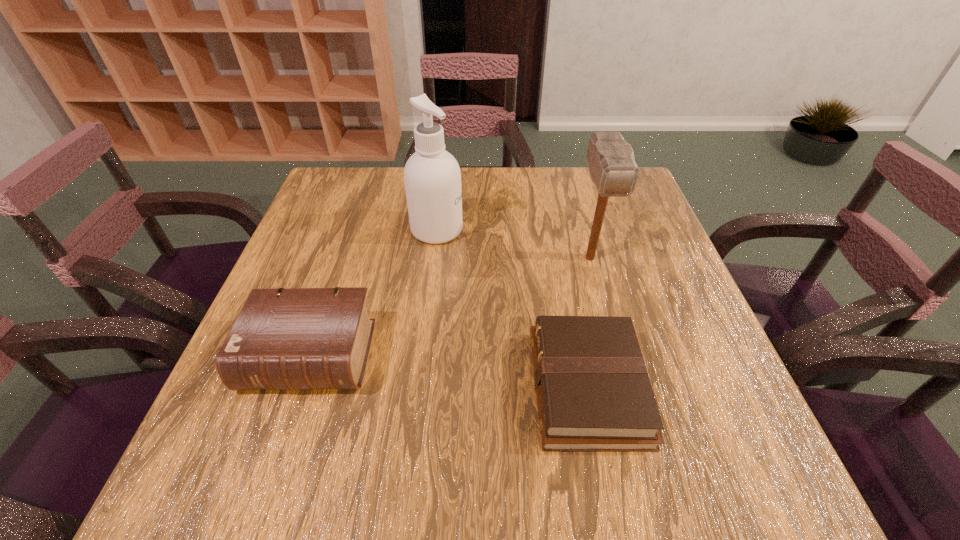
This screenshot has width=960, height=540. Identify the location of free space located 0.380m on the spine side of the right Bible. (323, 387).

I want to click on vacant area situated on the spine side of the right Bible, so click(x=339, y=387).

I want to click on object present at the far edge, so click(432, 177).

Find the location of a particular element. Image resolution: width=960 pixels, height=540 pixels. object at the near edge is located at coordinates (593, 391).

You are a GUI agent. You are given a task and a screenshot of the screen. Output one action in this format:
    pyautogui.click(x=<x>, y=<y>)
    Task: Click on the object located at the left edge
    
    Given the screenshot: What is the action you would take?
    pyautogui.click(x=289, y=338)

Where is `object that is at the right edge`? Image resolution: width=960 pixels, height=540 pixels. object that is at the right edge is located at coordinates (612, 166).

This screenshot has width=960, height=540. Find the location of `vacant area at the far edge`. vacant area at the far edge is located at coordinates (560, 174).

This screenshot has height=540, width=960. In the image, there is a desktop. What are the coordinates of `vacant space at the near edge` in the screenshot? It's located at (450, 462).

Where is `vacant area at the left edge of the desktop`? The height and width of the screenshot is (540, 960). vacant area at the left edge of the desktop is located at coordinates (348, 277).

The height and width of the screenshot is (540, 960). Find the location of `vacant region at the right edge of the desktop`. vacant region at the right edge of the desktop is located at coordinates (620, 252).